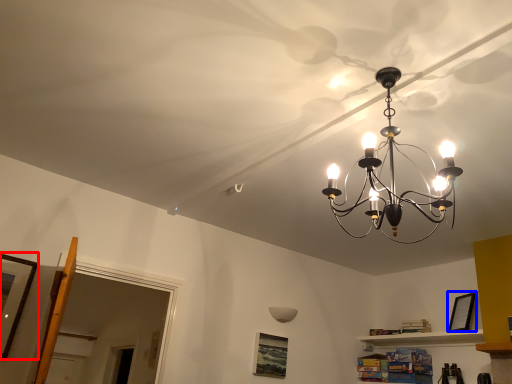
Question: Which object is further to the camera taking this photo, picture frame (highlighted by a red box) or picture frame (highlighted by a blue box)?

Choices:
 (A) picture frame
 (B) picture frame

Answer: (B)